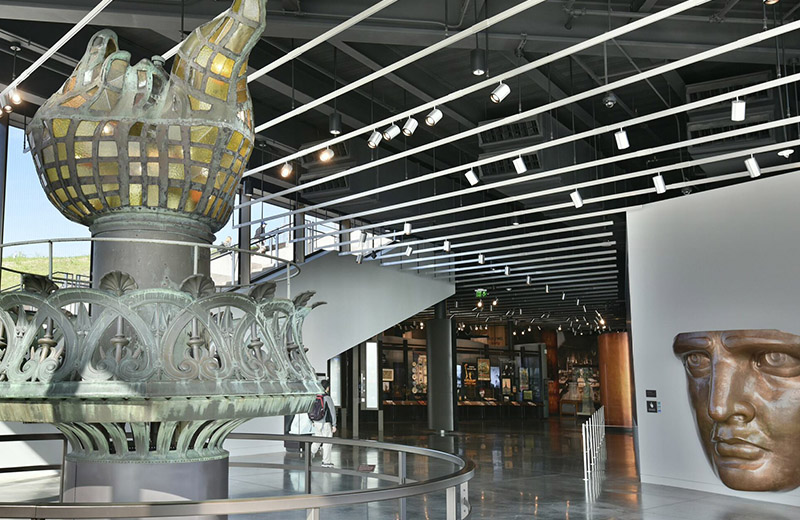
Where is `spotlights`? The height and width of the screenshot is (520, 800). spotlights is located at coordinates (442, 115), (488, 100), (409, 124), (393, 129), (374, 139), (474, 186), (514, 172), (622, 147).